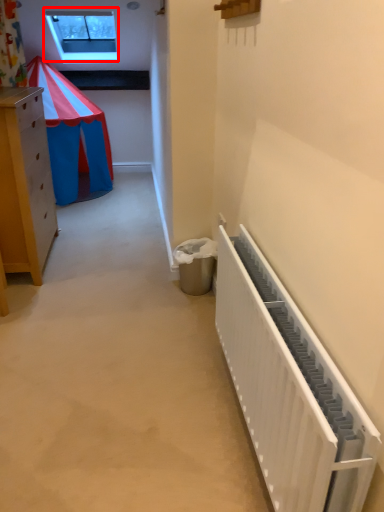
Question: From the image's perspective, what is the correct spatial relationship of window (annotated by the red box) in relation to radiator?

Choices:
 (A) above
 (B) below

Answer: (A)